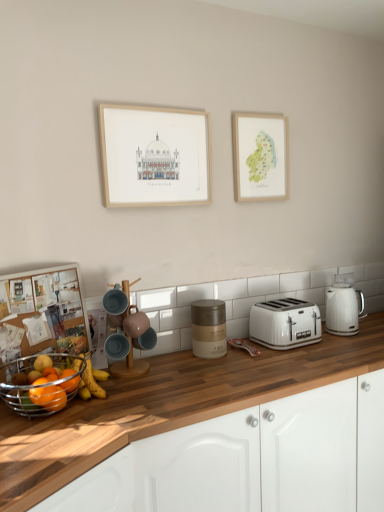
At what (x,y) coordinates should I click in order to perform the action: click on free space on the front side of matte ceramic coffee machine at center. Please return your answer as a coordinate pair (x, y). Looking at the image, I should click on (137, 389).